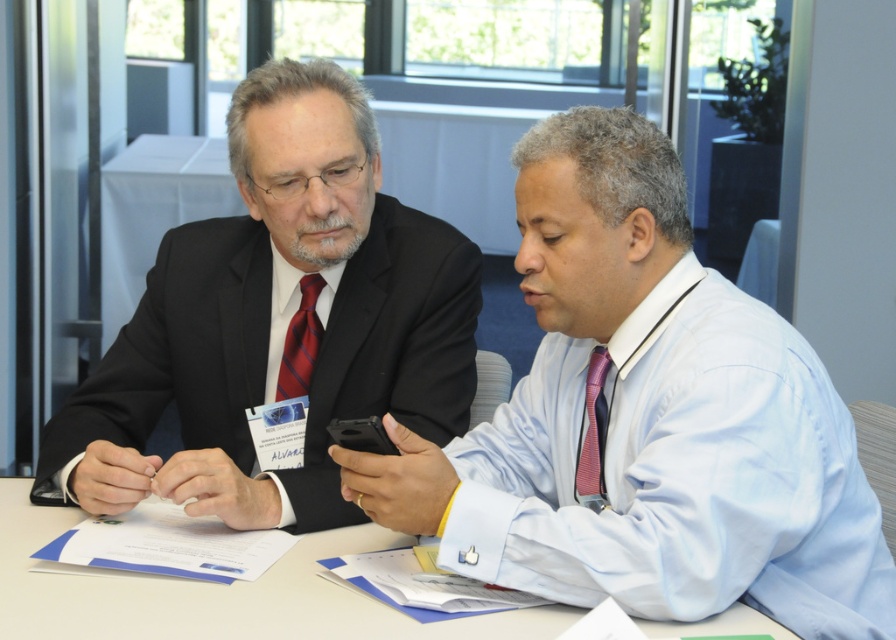
You are an assistant who needs to determine the spatial relationship between the two items mentioned. Based on the scene described, is the matte black suit at center located in front of or behind the matte red tie at center?

The matte black suit at center is in front of the matte red tie at center, so the matte black suit at center is located in front of the matte red tie at center.